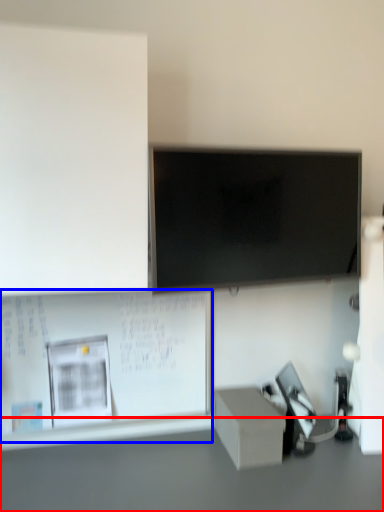
Question: Which object is further to the camera taking this photo, table (highlighted by a red box) or bulletin board (highlighted by a blue box)?

Choices:
 (A) table
 (B) bulletin board

Answer: (B)